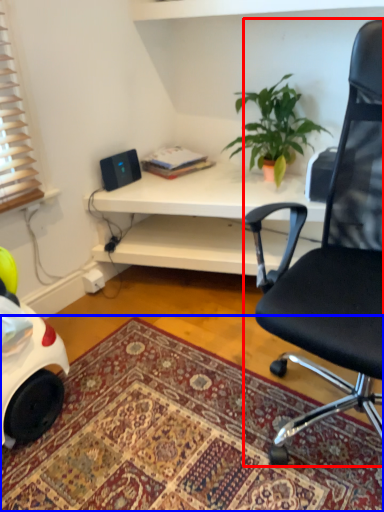
Question: Among these objects, which one is nearest to the camera, chair (highlighted by a red box) or mat (highlighted by a blue box)?

Choices:
 (A) chair
 (B) mat

Answer: (A)